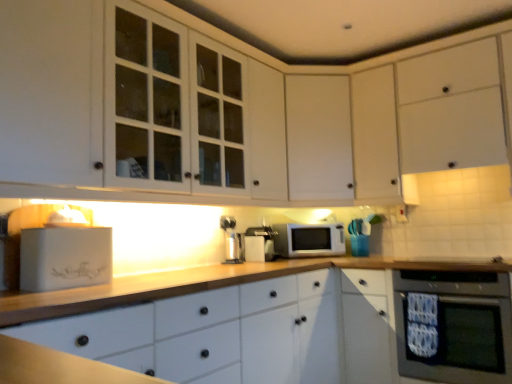
Question: Can you confirm if white matte bread bin at left is shorter than white matte cabinet at center, acting as the 2th cabinetry starting from the left?

Choices:
 (A) no
 (B) yes

Answer: (B)

Question: Would you say white matte bread bin at left is a long distance from white matte cabinet at center, marked as the 3th cabinetry in a right-to-left arrangement?

Choices:
 (A) yes
 (B) no

Answer: (B)

Question: Considering the relative sizes of white matte bread bin at left and white matte cabinet at center, acting as the 2th cabinetry starting from the left, in the image provided, is white matte bread bin at left thinner than white matte cabinet at center, acting as the 2th cabinetry starting from the left,?

Choices:
 (A) yes
 (B) no

Answer: (A)

Question: Is white matte bread bin at left not inside white matte cabinet at center, marked as the 3th cabinetry in a right-to-left arrangement?

Choices:
 (A) no
 (B) yes

Answer: (B)

Question: Is white matte bread bin at left smaller than white matte cabinet at center, acting as the 2th cabinetry starting from the left?

Choices:
 (A) no
 (B) yes

Answer: (B)

Question: Is the position of white matte bread bin at left less distant than that of white matte cabinet at center, acting as the 2th cabinetry starting from the left?

Choices:
 (A) yes
 (B) no

Answer: (B)

Question: Can you confirm if white plastic electric outlet at upper right is shorter than satin silver coffee machine at center, which is the first coffee machine in left-to-right order?

Choices:
 (A) yes
 (B) no

Answer: (A)

Question: Considering the relative sizes of white plastic electric outlet at upper right and satin silver coffee machine at center, which is the first coffee machine in left-to-right order, in the image provided, is white plastic electric outlet at upper right thinner than satin silver coffee machine at center, which is the first coffee machine in left-to-right order,?

Choices:
 (A) yes
 (B) no

Answer: (A)

Question: Is white plastic electric outlet at upper right not within satin silver coffee machine at center, which is the first coffee machine in left-to-right order?

Choices:
 (A) yes
 (B) no

Answer: (A)

Question: Is white plastic electric outlet at upper right turned away from satin silver coffee machine at center, which is the first coffee machine in left-to-right order?

Choices:
 (A) no
 (B) yes

Answer: (A)

Question: Is white plastic electric outlet at upper right facing towards satin silver coffee machine at center, arranged as the 2th coffee machine when viewed from the right?

Choices:
 (A) no
 (B) yes

Answer: (A)

Question: Is the position of white plastic electric outlet at upper right less distant than that of satin silver coffee machine at center, which is the first coffee machine in left-to-right order?

Choices:
 (A) yes
 (B) no

Answer: (B)

Question: Is black glass oven at lower right oriented away from white matte microwave at center?

Choices:
 (A) yes
 (B) no

Answer: (B)